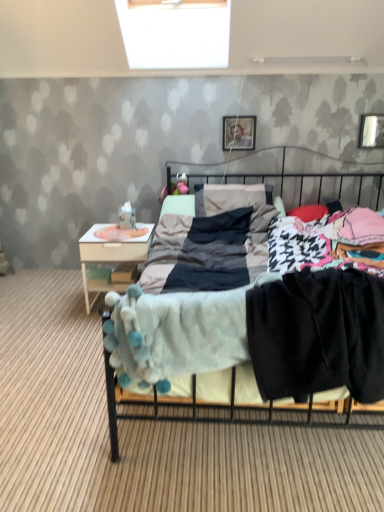
The image size is (384, 512). Describe the element at coordinates (371, 131) in the screenshot. I see `metallic rectangular frame at upper right, which is counted as the second picture frame, starting from the left` at that location.

Describe the element at coordinates (111, 255) in the screenshot. This screenshot has height=512, width=384. I see `white wood nightstand at left` at that location.

Identify the location of black cotton pants at lower right. (318, 334).

Choose the correct answer: Is soft gray blanket at center inside metallic rectangular frame at upper right, which is counted as the second picture frame, starting from the left, or outside it?

soft gray blanket at center cannot be found inside metallic rectangular frame at upper right, which is counted as the second picture frame, starting from the left.

From the image's perspective, would you say soft gray blanket at center is positioned over metallic rectangular frame at upper right, which ranks as the 1th picture frame in right-to-left order?

Incorrect, from the image's perspective, soft gray blanket at center is lower than metallic rectangular frame at upper right, which ranks as the 1th picture frame in right-to-left order.

Is metallic rectangular frame at upper right, which is counted as the second picture frame, starting from the left, at the back of soft gray blanket at center?

No, metallic rectangular frame at upper right, which is counted as the second picture frame, starting from the left, is not at the back of soft gray blanket at center.

I want to click on bed below the metallic rectangular frame at upper right, which ranks as the 1th picture frame in right-to-left order (from the image's perspective), so click(266, 177).

Is the depth of metallic rectangular frame at upper right, which ranks as the 1th picture frame in right-to-left order, less than that of wooden photo frame at upper center, which appears as the first picture frame when viewed from the left?

Yes, metallic rectangular frame at upper right, which ranks as the 1th picture frame in right-to-left order, is in front of wooden photo frame at upper center, which appears as the first picture frame when viewed from the left.

From a real-world perspective, relative to wooden photo frame at upper center, the 2th picture frame positioned from the right, is metallic rectangular frame at upper right, which is counted as the second picture frame, starting from the left, vertically above or below?

In terms of real-world spatial position, metallic rectangular frame at upper right, which is counted as the second picture frame, starting from the left, is above wooden photo frame at upper center, the 2th picture frame positioned from the right.

Could you tell me if metallic rectangular frame at upper right, which ranks as the 1th picture frame in right-to-left order, is facing wooden photo frame at upper center, which appears as the first picture frame when viewed from the left?

No, metallic rectangular frame at upper right, which ranks as the 1th picture frame in right-to-left order, is not facing towards wooden photo frame at upper center, which appears as the first picture frame when viewed from the left.

From a real-world perspective, which object rests below the other?

In real-world perspective, white plush toy at upper left is lower.

Is white plush toy at upper left positioned behind wooden photo frame at upper center, which appears as the first picture frame when viewed from the left?

No, white plush toy at upper left is in front of wooden photo frame at upper center, which appears as the first picture frame when viewed from the left.

Visually, is white plush toy at upper left positioned to the left or to the right of wooden photo frame at upper center, the 2th picture frame positioned from the right?

In the image, white plush toy at upper left appears on the left side of wooden photo frame at upper center, the 2th picture frame positioned from the right.

Consider the image. From the image's perspective, is white plush toy at upper left below wooden photo frame at upper center, the 2th picture frame positioned from the right?

Yes, from the image's perspective, white plush toy at upper left is beneath wooden photo frame at upper center, the 2th picture frame positioned from the right.

Considering the positions of points (293, 288) and (280, 195), is point (293, 288) closer to camera compared to point (280, 195)?

Yes, point (293, 288) is closer to viewer.

In terms of height, does black cotton pants at lower right look taller or shorter compared to soft gray blanket at center?

black cotton pants at lower right is shorter than soft gray blanket at center.

From the image's perspective, which is below, black cotton pants at lower right or soft gray blanket at center?

From the image's view, black cotton pants at lower right is below.

Who is smaller, black cotton pants at lower right or soft gray blanket at center?

black cotton pants at lower right is smaller.

Is black cotton pants at lower right bigger or smaller than wooden photo frame at upper center, which appears as the first picture frame when viewed from the left?

Clearly, black cotton pants at lower right is larger in size than wooden photo frame at upper center, which appears as the first picture frame when viewed from the left.

Would you say black cotton pants at lower right contains wooden photo frame at upper center, the 2th picture frame positioned from the right?

No, wooden photo frame at upper center, the 2th picture frame positioned from the right, is located outside of black cotton pants at lower right.

Can you tell me how much black cotton pants at lower right and wooden photo frame at upper center, the 2th picture frame positioned from the right, differ in facing direction?

black cotton pants at lower right and wooden photo frame at upper center, the 2th picture frame positioned from the right, are facing 2.94 degrees away from each other.

From a real-world perspective, between black cotton pants at lower right and wooden photo frame at upper center, the 2th picture frame positioned from the right, who is vertically higher?

wooden photo frame at upper center, the 2th picture frame positioned from the right.

Considering the sizes of objects metallic rectangular frame at upper right, which is counted as the second picture frame, starting from the left, and white plush toy at upper left in the image provided, who is wider, metallic rectangular frame at upper right, which is counted as the second picture frame, starting from the left, or white plush toy at upper left?

Wider between the two is white plush toy at upper left.

From the image's perspective, is metallic rectangular frame at upper right, which ranks as the 1th picture frame in right-to-left order, under white plush toy at upper left?

No, from the image's perspective, metallic rectangular frame at upper right, which ranks as the 1th picture frame in right-to-left order, is not below white plush toy at upper left.

How much distance is there between metallic rectangular frame at upper right, which is counted as the second picture frame, starting from the left, and white plush toy at upper left?

A distance of 6.28 feet exists between metallic rectangular frame at upper right, which is counted as the second picture frame, starting from the left, and white plush toy at upper left.

Considering the positions of objects metallic rectangular frame at upper right, which is counted as the second picture frame, starting from the left, and white plush toy at upper left in the image provided, who is more to the left, metallic rectangular frame at upper right, which is counted as the second picture frame, starting from the left, or white plush toy at upper left?

Positioned to the left is white plush toy at upper left.

Is metallic rectangular frame at upper right, which ranks as the 1th picture frame in right-to-left order, taller than black cotton pants at lower right?

No.

Could you measure the distance between metallic rectangular frame at upper right, which is counted as the second picture frame, starting from the left, and black cotton pants at lower right?

metallic rectangular frame at upper right, which is counted as the second picture frame, starting from the left, is 7.66 feet from black cotton pants at lower right.

Which of these two, metallic rectangular frame at upper right, which ranks as the 1th picture frame in right-to-left order, or black cotton pants at lower right, is smaller?

Smaller between the two is metallic rectangular frame at upper right, which ranks as the 1th picture frame in right-to-left order.

Is metallic rectangular frame at upper right, which ranks as the 1th picture frame in right-to-left order, far from black cotton pants at lower right?

Indeed, metallic rectangular frame at upper right, which ranks as the 1th picture frame in right-to-left order, is not near black cotton pants at lower right.

Where is `bed in front of the metallic rectangular frame at upper right, which ranks as the 1th picture frame in right-to-left order`? bed in front of the metallic rectangular frame at upper right, which ranks as the 1th picture frame in right-to-left order is located at coordinates (266, 177).

Find the location of a particular element. The height and width of the screenshot is (512, 384). picture frame below the metallic rectangular frame at upper right, which is counted as the second picture frame, starting from the left (from a real-world perspective) is located at coordinates (239, 132).

When comparing their distances from black cotton pants at lower right, does metallic rectangular frame at upper right, which ranks as the 1th picture frame in right-to-left order, or soft gray blanket at center seem further?

Among the two, metallic rectangular frame at upper right, which ranks as the 1th picture frame in right-to-left order, is located further to black cotton pants at lower right.

Looking at the image, which one is located further to white wood nightstand at left, wooden photo frame at upper center, the 2th picture frame positioned from the right, or black cotton pants at lower right?

Among the two, black cotton pants at lower right is located further to white wood nightstand at left.

Which object lies nearer to the anchor point soft gray blanket at center, wooden photo frame at upper center, the 2th picture frame positioned from the right, or white wood nightstand at left?

wooden photo frame at upper center, the 2th picture frame positioned from the right, is closer to soft gray blanket at center.

Estimate the real-world distances between objects in this image. Which object is further from metallic rectangular frame at upper right, which is counted as the second picture frame, starting from the left, wooden photo frame at upper center, which appears as the first picture frame when viewed from the left, or soft gray blanket at center?

wooden photo frame at upper center, which appears as the first picture frame when viewed from the left, is further to metallic rectangular frame at upper right, which is counted as the second picture frame, starting from the left.

Which object lies further to the anchor point black cotton pants at lower right, metallic rectangular frame at upper right, which is counted as the second picture frame, starting from the left, or wooden photo frame at upper center, which appears as the first picture frame when viewed from the left?

Based on the image, metallic rectangular frame at upper right, which is counted as the second picture frame, starting from the left, appears to be further to black cotton pants at lower right.

Looking at the image, which one is located further to white wood nightstand at left, white plush toy at upper left or wooden photo frame at upper center, the 2th picture frame positioned from the right?

wooden photo frame at upper center, the 2th picture frame positioned from the right.

Based on their spatial positions, is metallic rectangular frame at upper right, which is counted as the second picture frame, starting from the left, or white plush toy at upper left closer to wooden photo frame at upper center, which appears as the first picture frame when viewed from the left?

metallic rectangular frame at upper right, which is counted as the second picture frame, starting from the left, is closer to wooden photo frame at upper center, which appears as the first picture frame when viewed from the left.

Which object lies further to the anchor point soft gray blanket at center, metallic rectangular frame at upper right, which ranks as the 1th picture frame in right-to-left order, or wooden photo frame at upper center, which appears as the first picture frame when viewed from the left?

metallic rectangular frame at upper right, which ranks as the 1th picture frame in right-to-left order, lies further to soft gray blanket at center than the other object.

At what (x,y) coordinates should I click in order to perform the action: click on toy between soft gray blanket at center and wooden photo frame at upper center, the 2th picture frame positioned from the right, in the front-back direction. Please return your answer as a coordinate pair (x, y). Looking at the image, I should click on (127, 216).

Find the location of `nightstand between black cotton pants at lower right and white plush toy at upper left in the front-back direction`. nightstand between black cotton pants at lower right and white plush toy at upper left in the front-back direction is located at coordinates (111, 255).

At what (x,y) coordinates should I click in order to perform the action: click on clothing located between soft gray blanket at center and wooden photo frame at upper center, which appears as the first picture frame when viewed from the left, in the depth direction. Please return your answer as a coordinate pair (x, y). The image size is (384, 512). Looking at the image, I should click on (318, 334).

The image size is (384, 512). What are the coordinates of `toy between white wood nightstand at left and metallic rectangular frame at upper right, which ranks as the 1th picture frame in right-to-left order` in the screenshot? It's located at (127, 216).